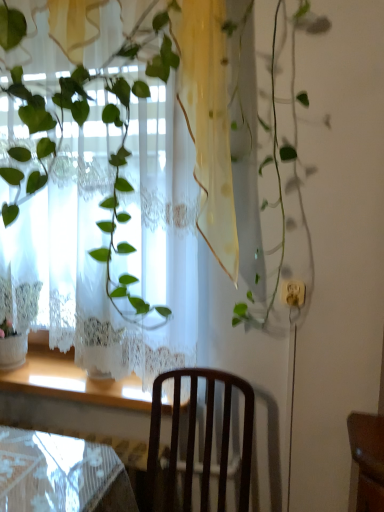
Question: Is dark wood chair at center wider or thinner than white lace curtain at upper left?

Choices:
 (A) thin
 (B) wide

Answer: (B)

Question: Considering their positions, is dark wood chair at center located in front of or behind white lace curtain at upper left?

Choices:
 (A) front
 (B) behind

Answer: (A)

Question: Based on their relative distances, which object is nearer to the dark wood chair at center?

Choices:
 (A) white lace curtain at upper left
 (B) wooden at lower left

Answer: (B)

Question: Which is farther from the wooden at lower left?

Choices:
 (A) white lace curtain at upper left
 (B) dark wood chair at center

Answer: (A)